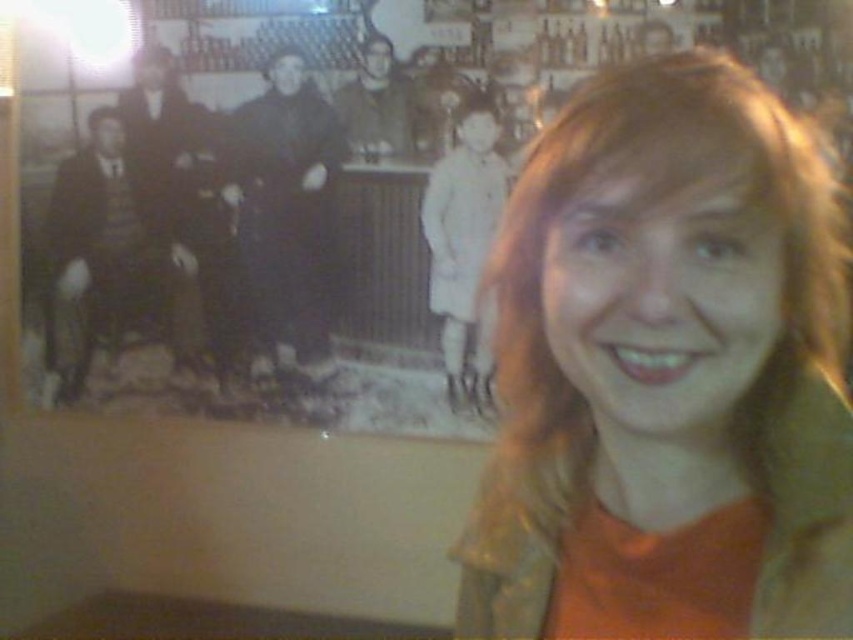
Question: Which object is farther from the camera taking this photo?

Choices:
 (A) light beige coat at center
 (B) orange fabric at center
 (C) smooth black coat at center

Answer: (C)

Question: Does orange fabric at center have a smaller size compared to smooth black coat at center?

Choices:
 (A) yes
 (B) no

Answer: (A)

Question: Is orange fabric at center smaller than light beige coat at center?

Choices:
 (A) no
 (B) yes

Answer: (B)

Question: Which point is closer to the camera?

Choices:
 (A) (503, 166)
 (B) (691, 492)

Answer: (B)

Question: Is orange fabric at center above smooth black coat at center?

Choices:
 (A) yes
 (B) no

Answer: (B)

Question: Which of the following is the farthest from the observer?

Choices:
 (A) smooth black coat at center
 (B) orange fabric at center
 (C) light beige coat at center

Answer: (A)